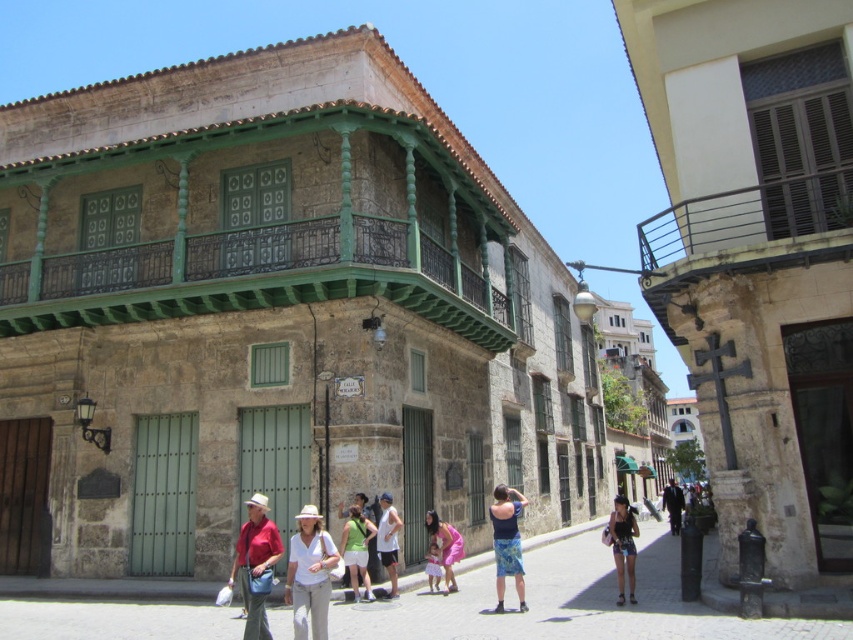
You are a tourist standing on the street in front of the historic building. You see a white matte hat at center and denim shorts at lower right. Which object is positioned higher in the image?

The white matte hat at center is located above denim shorts at lower right, so it is positioned higher in the image.

You are a painter standing on the street looking at the green painted wood at upper center and the pink fabric dress at center. Which object is wider from your perspective?

The green painted wood at upper center is wider than the pink fabric dress at center.

You are a tourist standing in the street and see the brown metal railing at upper right and the dark blue jeans at center. Which object is located to the right of the other?

The brown metal railing at upper right is positioned on the right side of dark blue jeans at center.